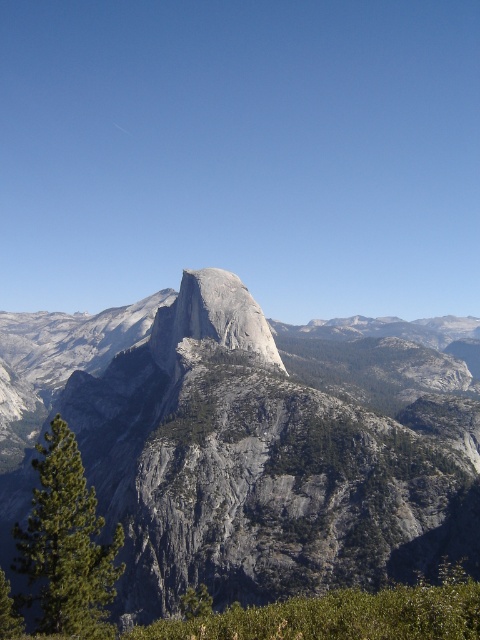
Is green textured pine tree at lower left thinner than gray/granite peak at center?

In fact, green textured pine tree at lower left might be wider than gray/granite peak at center.

Between green textured pine tree at lower left and gray/granite peak at center, which one has more height?

green textured pine tree at lower left

This screenshot has width=480, height=640. What do you see at coordinates (67, 545) in the screenshot?
I see `green textured pine tree at lower left` at bounding box center [67, 545].

Identify the location of green textured pine tree at lower left. (67, 545).

Is gray rock mountain at center wider than gray/granite peak at center?

Yes.

Consider the image. Is gray rock mountain at center to the left of gray/granite peak at center from the viewer's perspective?

Incorrect, gray rock mountain at center is not on the left side of gray/granite peak at center.

Is point (100, 323) positioned in front of point (242, 332)?

No.

Image resolution: width=480 pixels, height=640 pixels. Find the location of `gray rock mountain at center`. gray rock mountain at center is located at coordinates (245, 444).

Which is in front, point (225, 454) or point (103, 608)?

Point (103, 608)

Does point (118, 406) come farther from viewer compared to point (88, 564)?

Yes, point (118, 406) is farther from viewer.

Find the location of a particular element. gray rock mountain at center is located at coordinates (245, 444).